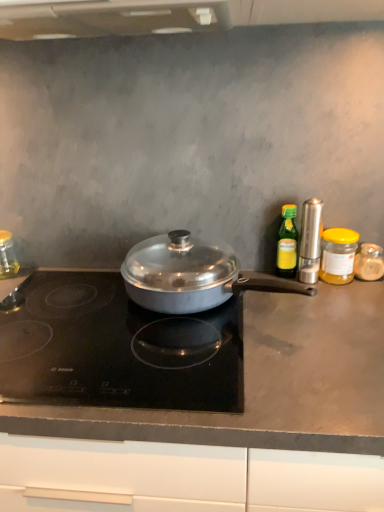
At what (x,y) coordinates should I click in order to perform the action: click on free space in front of satin silver pan at center, the 2th kitchen appliance from the left. Please return your answer as a coordinate pair (x, y). This screenshot has height=512, width=384. Looking at the image, I should click on (235, 382).